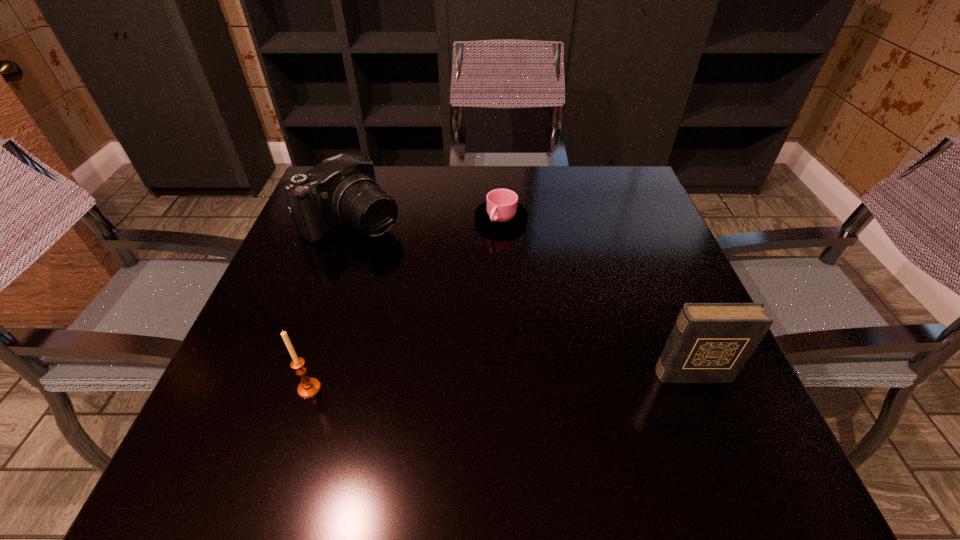
At what (x,y) coordinates should I click in order to perform the action: click on candle_holder. Please return your answer as a coordinate pair (x, y). The height and width of the screenshot is (540, 960). Looking at the image, I should click on (309, 387).

In order to click on diary in this screenshot , I will do click(710, 342).

The image size is (960, 540). What are the coordinates of `camera` in the screenshot? It's located at (342, 189).

You are a GUI agent. You are given a task and a screenshot of the screen. Output one action in this format:
    pyautogui.click(x=<x>, y=<y>)
    Task: Click on the cup
    This screenshot has height=540, width=960.
    Given the screenshot: What is the action you would take?
    pyautogui.click(x=501, y=212)

What are the coordinates of `the second object from right to left` in the screenshot? It's located at (501, 212).

Identify the location of vacant space positioned 0.280m on the right of the candle_holder. (482, 389).

Image resolution: width=960 pixels, height=540 pixels. In order to click on vacant area located 0.070m on the front cover of the rightmost object in this screenshot , I will do `click(710, 421)`.

Locate an element on the screen. This screenshot has height=540, width=960. free space located on the lens of the camera is located at coordinates (405, 258).

This screenshot has height=540, width=960. What are the coordinates of `vacant region located 0.220m on the lens of the camera` in the screenshot? It's located at (442, 287).

Image resolution: width=960 pixels, height=540 pixels. Find the location of `vacant space positioned 0.340m on the lens of the camera`. vacant space positioned 0.340m on the lens of the camera is located at coordinates (480, 319).